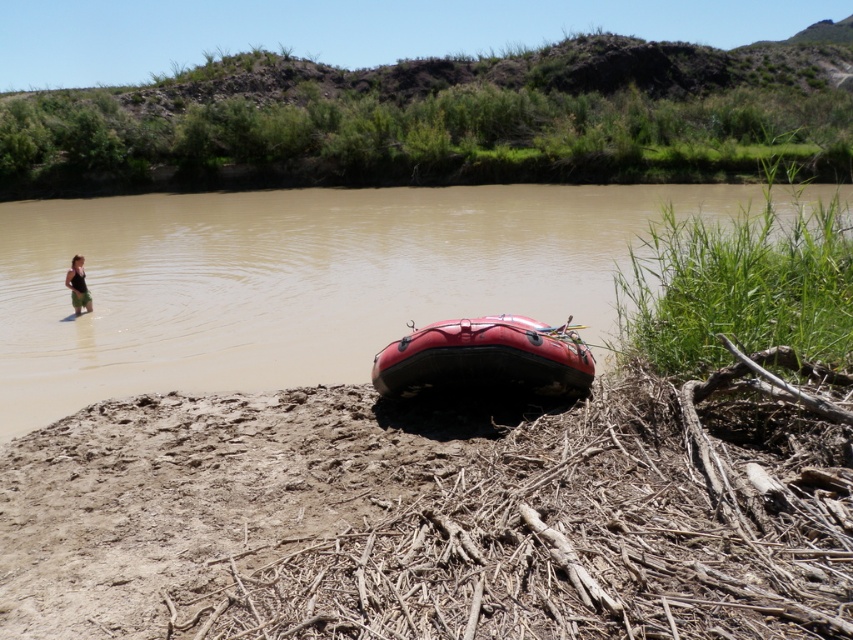
Is rubber boat at lower center further to camera compared to matte black swimsuit at left?

No, rubber boat at lower center is in front of matte black swimsuit at left.

Who is positioned more to the left, rubber boat at lower center or matte black swimsuit at left?

From the viewer's perspective, matte black swimsuit at left appears more on the left side.

Identify the location of rubber boat at lower center. (485, 358).

Between point (309, 342) and point (379, 358), which one is positioned behind?

The point (309, 342) is more distant.

Which of these two, brown muddy water at lower center or rubber boat at lower center, stands shorter?

rubber boat at lower center

Between point (782, 209) and point (503, 362), which one is positioned behind?

The point (782, 209) is behind.

This screenshot has height=640, width=853. I want to click on brown muddy water at lower center, so click(299, 280).

Who is positioned more to the right, brown muddy water at lower center or matte black swimsuit at left?

brown muddy water at lower center

Is brown muddy water at lower center above matte black swimsuit at left?

Yes, brown muddy water at lower center is above matte black swimsuit at left.

Describe the element at coordinates (299, 280) in the screenshot. I see `brown muddy water at lower center` at that location.

At what (x,y) coordinates should I click in order to perform the action: click on brown muddy water at lower center. Please return your answer as a coordinate pair (x, y). Looking at the image, I should click on (299, 280).